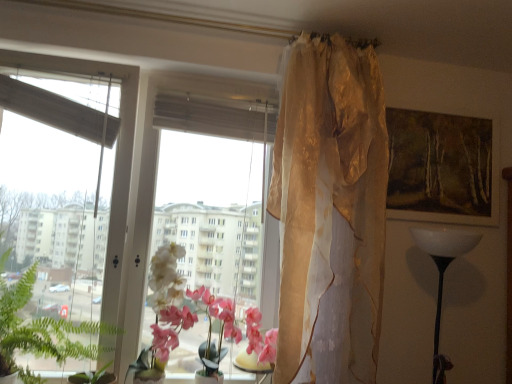
Question: From a real-world perspective, is translucent glass table at center physically located above or below green leafy plant at left?

Choices:
 (A) below
 (B) above

Answer: (A)

Question: Considering the positions of point (257, 370) and point (49, 317), is point (257, 370) closer or farther from the camera than point (49, 317)?

Choices:
 (A) farther
 (B) closer

Answer: (A)

Question: Estimate the real-world distances between objects in this image. Which object is farther from the pink silk orchid at center?

Choices:
 (A) translucent glass table at center
 (B) green leafy plant at left
 (C) wooden framed painting at upper right
 (D) translucent gold curtain at upper center
 (E) transparent glass window at center

Answer: (C)

Question: Which is farther from the translucent gold curtain at upper center?

Choices:
 (A) transparent glass window at center
 (B) pink silk orchid at center
 (C) green leafy plant at left
 (D) translucent glass table at center
 (E) wooden framed painting at upper right

Answer: (C)